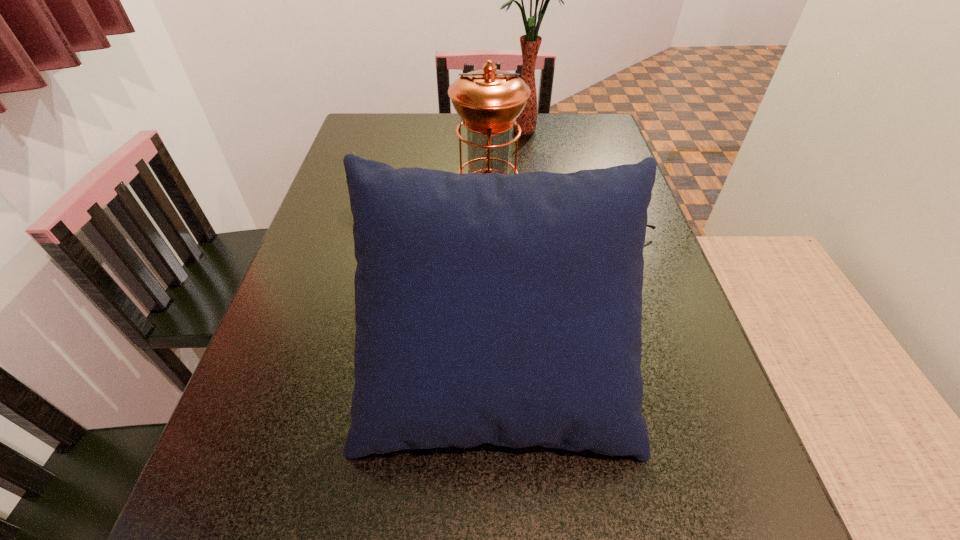
Where is `free location located on the front of the leftmost object`? The width and height of the screenshot is (960, 540). free location located on the front of the leftmost object is located at coordinates (359, 225).

Locate an element on the screen. Image resolution: width=960 pixels, height=540 pixels. vacant area situated on the front-facing side of the sunglasses is located at coordinates (452, 224).

Find the location of a particular element. vacant space located 0.130m on the front-facing side of the sunglasses is located at coordinates (542, 224).

Locate an element on the screen. vacant space located 0.240m on the front-facing side of the sunglasses is located at coordinates (495, 224).

Where is `object located at the far edge`? This screenshot has height=540, width=960. object located at the far edge is located at coordinates (530, 43).

In order to click on object at the left edge in this screenshot , I will do `click(352, 151)`.

This screenshot has height=540, width=960. Identify the location of cushion present at the right edge. (506, 309).

The width and height of the screenshot is (960, 540). What are the coordinates of `sunglasses that is at the right edge` in the screenshot? It's located at (653, 227).

Identify the location of vacant position at the far edge of the desktop. Image resolution: width=960 pixels, height=540 pixels. (432, 140).

This screenshot has width=960, height=540. In the image, there is a desktop. In order to click on free space at the left edge in this screenshot , I will do `click(313, 231)`.